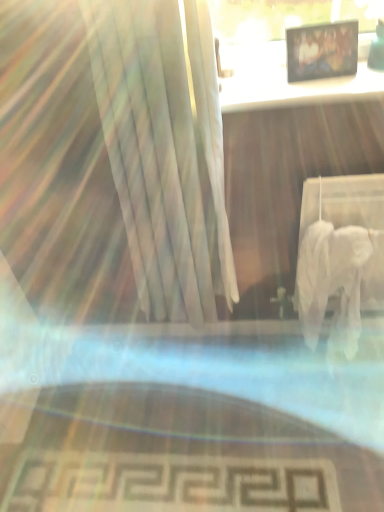
Identify the location of wooden photo frame at upper center. (321, 51).

This screenshot has height=512, width=384. What do you see at coordinates (321, 51) in the screenshot? I see `wooden photo frame at upper center` at bounding box center [321, 51].

In order to face wooden photo frame at upper center, should I rotate leftwards or rightwards?

Rotate your view right by about 16.869°.

Where is `wooden table at upper center`? wooden table at upper center is located at coordinates (286, 79).

This screenshot has height=512, width=384. What do you see at coordinates (286, 79) in the screenshot?
I see `wooden table at upper center` at bounding box center [286, 79].

This screenshot has height=512, width=384. Find the location of `wooden photo frame at upper center`. wooden photo frame at upper center is located at coordinates (321, 51).

Is wooden photo frame at upper center at the right side of wooden table at upper center?

Yes.

Is wooden photo frame at upper center behind wooden table at upper center?

That is True.

Which is less distant, (338, 51) or (278, 42)?

The point (338, 51) is closer.

From the image's perspective, between wooden photo frame at upper center and wooden table at upper center, which one is located above?

wooden photo frame at upper center.

From a real-world perspective, between wooden photo frame at upper center and wooden table at upper center, who is vertically lower?

From a 3D spatial view, wooden table at upper center is below.

Between wooden photo frame at upper center and wooden table at upper center, which one has larger width?

wooden table at upper center is wider.

Considering the sizes of objects wooden photo frame at upper center and wooden table at upper center in the image provided, who is shorter, wooden photo frame at upper center or wooden table at upper center?

With less height is wooden table at upper center.

Considering the sizes of objects wooden photo frame at upper center and wooden table at upper center in the image provided, who is smaller, wooden photo frame at upper center or wooden table at upper center?

With smaller size is wooden photo frame at upper center.

Is wooden photo frame at upper center not within wooden table at upper center?

wooden photo frame at upper center lies outside wooden table at upper center's area.

Is wooden photo frame at upper center not close to wooden table at upper center?

wooden photo frame at upper center is actually quite close to wooden table at upper center.

Is wooden photo frame at upper center aimed at wooden table at upper center?

No, wooden photo frame at upper center is not facing towards wooden table at upper center.

You are a GUI agent. You are given a task and a screenshot of the screen. Output one action in this format:
    pyautogui.click(x=<x>, y=<y>)
    Task: Click on the picture frame lying behind the wooden table at upper center
    The width and height of the screenshot is (384, 512).
    Given the screenshot: What is the action you would take?
    pyautogui.click(x=321, y=51)

Considering the relative positions of wooden table at upper center and wooden photo frame at upper center in the image provided, is wooden table at upper center to the left of wooden photo frame at upper center from the viewer's perspective?

Yes.

From the picture: Relative to wooden photo frame at upper center, is wooden table at upper center in front or behind?

wooden table at upper center is positioned closer to the viewer than wooden photo frame at upper center.

Which point is more forward, (226,101) or (319,55)?

The point (226,101) is more forward.

From the image's perspective, which one is positioned higher, wooden table at upper center or wooden photo frame at upper center?

wooden photo frame at upper center appears higher in the image.

From a real-world perspective, is wooden table at upper center physically above wooden photo frame at upper center?

A: No.

Does wooden table at upper center have a greater width compared to wooden photo frame at upper center?

Yes.

Does wooden table at upper center have a lesser height compared to wooden photo frame at upper center?

Yes.

Can you confirm if wooden table at upper center is smaller than wooden photo frame at upper center?

No.

Is wooden table at upper center surrounding wooden photo frame at upper center?

No, wooden photo frame at upper center is located outside of wooden table at upper center.

Is wooden table at upper center in contact with wooden photo frame at upper center?

Yes, wooden table at upper center is beside wooden photo frame at upper center.

Is wooden table at upper center positioned with its back to wooden photo frame at upper center?

wooden table at upper center does not have its back to wooden photo frame at upper center.

The width and height of the screenshot is (384, 512). What are the coordinates of `table below the wooden photo frame at upper center (from a real-world perspective)` in the screenshot? It's located at (286, 79).

Locate an element on the screen. The height and width of the screenshot is (512, 384). picture frame to the right of wooden table at upper center is located at coordinates (321, 51).

At what (x,y) coordinates should I click in order to perform the action: click on picture frame behind the wooden table at upper center. Please return your answer as a coordinate pair (x, y). The image size is (384, 512). Looking at the image, I should click on (321, 51).